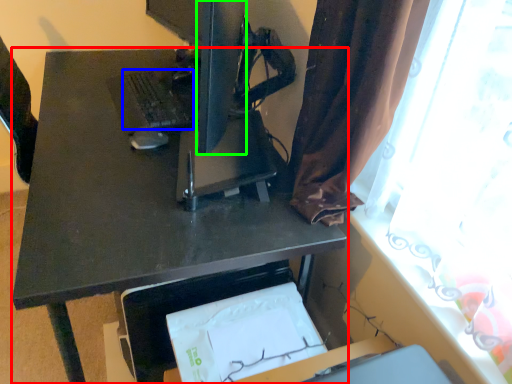
Question: Which is nearer to the desk (highlighted by a red box)? laptop keyboard (highlighted by a blue box) or computer monitor (highlighted by a green box).

Choices:
 (A) laptop keyboard
 (B) computer monitor

Answer: (A)